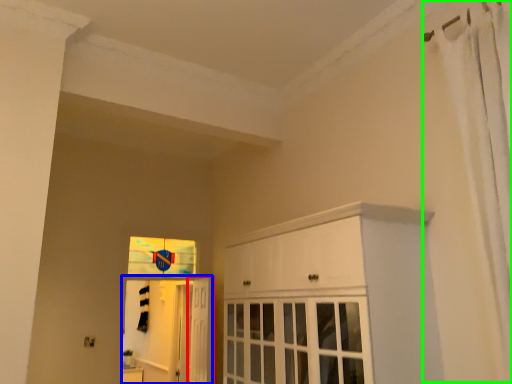
Question: Considering the real-world distances, which object is farthest from door (highlighted by a red box)? elevator (highlighted by a blue box) or shower curtain (highlighted by a green box)?

Choices:
 (A) elevator
 (B) shower curtain

Answer: (B)